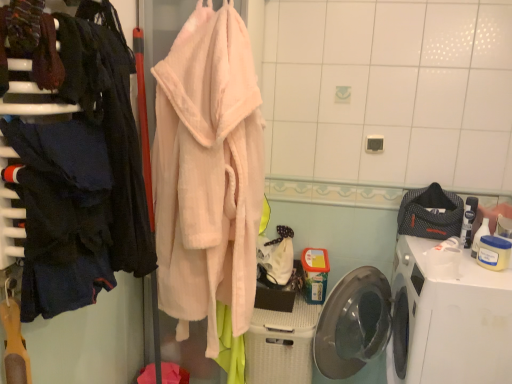
What do you see at coordinates (85, 345) in the screenshot? Image resolution: width=512 pixels, height=384 pixels. I see `soft pink plush robe at center, which is counted as the 1th closet, starting from the back` at bounding box center [85, 345].

Locate an element on the screen. The width and height of the screenshot is (512, 384). dark blue fabric at left, the second closet when ordered from back to front is located at coordinates (79, 171).

Image resolution: width=512 pixels, height=384 pixels. Describe the element at coordinates (448, 321) in the screenshot. I see `white plastic washing machine at lower right` at that location.

The height and width of the screenshot is (384, 512). Describe the element at coordinates (208, 173) in the screenshot. I see `peach fluffy bathrobe at center` at that location.

In order to face white plastic basket at lower center, should I rotate leftwards or rightwards?

You should look right and rotate roughly 3.962 degrees.

At what (x,y) coordinates should I click in order to perform the action: click on dark blue fabric at left, which ranks as the second clothing in back-to-front order. Please return your answer as a coordinate pair (x, y). Looking at the image, I should click on (63, 214).

Locate an element on the screen. The image size is (512, 384). soft pink plush robe at center, acting as the 2th closet starting from the front is located at coordinates (85, 345).

Looking at their sizes, would you say dark blue fabric at left, which is the first closet from front to back, is wider or thinner than peach fluffy bathrobe at center?

Considering their sizes, dark blue fabric at left, which is the first closet from front to back, looks slimmer than peach fluffy bathrobe at center.

Is dark blue fabric at left, which is the first closet from front to back, not close to peach fluffy bathrobe at center?

Actually, dark blue fabric at left, which is the first closet from front to back, and peach fluffy bathrobe at center are a little close together.

In the scene shown: Is dark blue fabric at left, the second closet when ordered from back to front, inside the boundaries of peach fluffy bathrobe at center, or outside?

dark blue fabric at left, the second closet when ordered from back to front, is outside peach fluffy bathrobe at center.

Does dark blue fabric at left, the second closet when ordered from back to front, turn towards peach fluffy bathrobe at center?

No.

Which object is thinner, dark blue fabric at left, which is the first closet from front to back, or textured gray bag at right, placed as the 2th clothing when sorted from left to right?

Thinner between the two is dark blue fabric at left, which is the first closet from front to back.

Is dark blue fabric at left, which is the first closet from front to back, next to textured gray bag at right, the 2th clothing positioned from the front?

No, dark blue fabric at left, which is the first closet from front to back, is not making contact with textured gray bag at right, the 2th clothing positioned from the front.

Considering the positions of objects dark blue fabric at left, the second closet when ordered from back to front, and textured gray bag at right, positioned as the 1th clothing in right-to-left order, in the image provided, who is behind, dark blue fabric at left, the second closet when ordered from back to front, or textured gray bag at right, positioned as the 1th clothing in right-to-left order,?

Positioned behind is textured gray bag at right, positioned as the 1th clothing in right-to-left order.

Is white plastic basket at lower center in front of or behind dark blue fabric at left, which ranks as the first clothing in front-to-back order, in the image?

Visually, white plastic basket at lower center is located behind dark blue fabric at left, which ranks as the first clothing in front-to-back order.

How many degrees apart are the facing directions of white plastic basket at lower center and dark blue fabric at left, marked as the first clothing in a left-to-right arrangement?

The angular difference between white plastic basket at lower center and dark blue fabric at left, marked as the first clothing in a left-to-right arrangement, is 89.8 degrees.

Is white plastic basket at lower center bigger than dark blue fabric at left, marked as the first clothing in a left-to-right arrangement?

Yes.

Is white plastic basket at lower center not near dark blue fabric at left, which ranks as the first clothing in front-to-back order?

No, white plastic basket at lower center is not far from dark blue fabric at left, which ranks as the first clothing in front-to-back order.

Is there a large distance between white plastic basket at lower center and textured gray bag at right, the 2th clothing positioned from the front?

That's not correct — white plastic basket at lower center is a little close to textured gray bag at right, the 2th clothing positioned from the front.

Can you confirm if white plastic basket at lower center is wider than textured gray bag at right, positioned as the 1th clothing in right-to-left order?

Yes.

Which object is positioned more to the left, white plastic basket at lower center or textured gray bag at right, the first clothing positioned from the back?

From the viewer's perspective, white plastic basket at lower center appears more on the left side.

At what (x,y) coordinates should I click in order to perform the action: click on closet located above the textured gray bag at right, the first clothing positioned from the back (from the image's perspective). Please return your answer as a coordinate pair (x, y). This screenshot has width=512, height=384. Looking at the image, I should click on (79, 171).

From a real-world perspective, which is physically below, textured gray bag at right, positioned as the 1th clothing in right-to-left order, or dark blue fabric at left, which is the first closet from front to back?

textured gray bag at right, positioned as the 1th clothing in right-to-left order, is physically lower.

Which object is closer to the camera, textured gray bag at right, the first clothing positioned from the back, or dark blue fabric at left, the second closet when ordered from back to front?

dark blue fabric at left, the second closet when ordered from back to front, is closer to the camera.

From the image's perspective, who appears lower, textured gray bag at right, the 2th clothing positioned from the front, or dark blue fabric at left, the second closet when ordered from back to front?

textured gray bag at right, the 2th clothing positioned from the front, from the image's perspective.

Is dark blue fabric at left, which ranks as the first clothing in front-to-back order, completely or partially outside of white plastic basket at lower center?

Yes, dark blue fabric at left, which ranks as the first clothing in front-to-back order, is located beyond the bounds of white plastic basket at lower center.

Between dark blue fabric at left, which ranks as the first clothing in front-to-back order, and white plastic basket at lower center, which one appears on the right side from the viewer's perspective?

From the viewer's perspective, white plastic basket at lower center appears more on the right side.

Considering their positions, is dark blue fabric at left, which ranks as the first clothing in front-to-back order, located in front of or behind white plastic basket at lower center?

In the image, dark blue fabric at left, which ranks as the first clothing in front-to-back order, appears in front of white plastic basket at lower center.

From a real-world perspective, which clothing is the 2nd one above the white plastic basket at lower center? Please provide its 2D coordinates.

[(63, 214)]

Is point (91, 163) less distant than point (100, 266)?

Yes, it is.

From the image's perspective, which is below, dark blue fabric at left, which is the first closet from front to back, or dark blue fabric at left, which ranks as the second clothing in back-to-front order?

dark blue fabric at left, which ranks as the second clothing in back-to-front order, is shown below in the image.

From the picture: Are dark blue fabric at left, the second closet when ordered from back to front, and dark blue fabric at left, which ranks as the second clothing in back-to-front order, located far from each other?

No, there isn't a large distance between dark blue fabric at left, the second closet when ordered from back to front, and dark blue fabric at left, which ranks as the second clothing in back-to-front order.

From the peach fluffy bathrobe at center, count the 2nd closet to the left and point to it. Please provide its 2D coordinates.

[(79, 171)]

I want to click on clothing that is the 2nd object located behind the dark blue fabric at left, which is the first closet from front to back, so click(430, 213).

When comparing their distances from textured gray bag at right, the first clothing positioned from the back, does peach fluffy bathrobe at center or dark blue fabric at left, the second closet when ordered from back to front, seem further?

dark blue fabric at left, the second closet when ordered from back to front, is further to textured gray bag at right, the first clothing positioned from the back.

Estimate the real-world distances between objects in this image. Which object is further from textured gray bag at right, placed as the 2th clothing when sorted from left to right, white plastic basket at lower center or soft pink plush robe at center, which is counted as the 1th closet, starting from the back?

soft pink plush robe at center, which is counted as the 1th closet, starting from the back.

Looking at the image, which one is located further to white plastic basket at lower center, dark blue fabric at left, the second closet when ordered from back to front, or textured gray bag at right, positioned as the 1th clothing in right-to-left order?

dark blue fabric at left, the second closet when ordered from back to front.

Based on their spatial positions, is dark blue fabric at left, which ranks as the second clothing in back-to-front order, or dark blue fabric at left, the second closet when ordered from back to front, closer to white plastic washing machine at lower right?

dark blue fabric at left, the second closet when ordered from back to front, lies closer to white plastic washing machine at lower right than the other object.

Considering their positions, is white plastic basket at lower center positioned closer to dark blue fabric at left, which is the first closet from front to back, than peach fluffy bathrobe at center?

peach fluffy bathrobe at center is closer to dark blue fabric at left, which is the first closet from front to back.

When comparing their distances from peach fluffy bathrobe at center, does textured gray bag at right, the 2th clothing positioned from the front, or dark blue fabric at left, marked as the first clothing in a left-to-right arrangement, seem further?

Based on the image, textured gray bag at right, the 2th clothing positioned from the front, appears to be further to peach fluffy bathrobe at center.

Based on their spatial positions, is white plastic basket at lower center or peach fluffy bathrobe at center closer to white plastic washing machine at lower right?

white plastic basket at lower center is positioned closer to the anchor white plastic washing machine at lower right.

Which object lies further to the anchor point peach fluffy bathrobe at center, dark blue fabric at left, which is the first closet from front to back, or soft pink plush robe at center, which is counted as the 1th closet, starting from the back?

Based on the image, soft pink plush robe at center, which is counted as the 1th closet, starting from the back, appears to be further to peach fluffy bathrobe at center.

Identify the location of clothing located between dark blue fabric at left, the second closet when ordered from back to front, and white plastic washing machine at lower right in the left-right direction. The image size is (512, 384). (63, 214).

Locate an element on the screen. The width and height of the screenshot is (512, 384). washing machine between soft pink plush robe at center, which is counted as the 1th closet, starting from the back, and textured gray bag at right, the first clothing positioned from the back is located at coordinates (448, 321).

At what (x,y) coordinates should I click in order to perform the action: click on dish washer between dark blue fabric at left, which is the first closet from front to back, and textured gray bag at right, the 2th clothing positioned from the front, in the horizontal direction. Please return your answer as a coordinate pair (x, y). The width and height of the screenshot is (512, 384). Looking at the image, I should click on (281, 344).

This screenshot has height=384, width=512. Find the location of `washing machine between textured gray bag at right, positioned as the 1th clothing in right-to-left order, and white plastic basket at lower center vertically`. washing machine between textured gray bag at right, positioned as the 1th clothing in right-to-left order, and white plastic basket at lower center vertically is located at coordinates (448, 321).